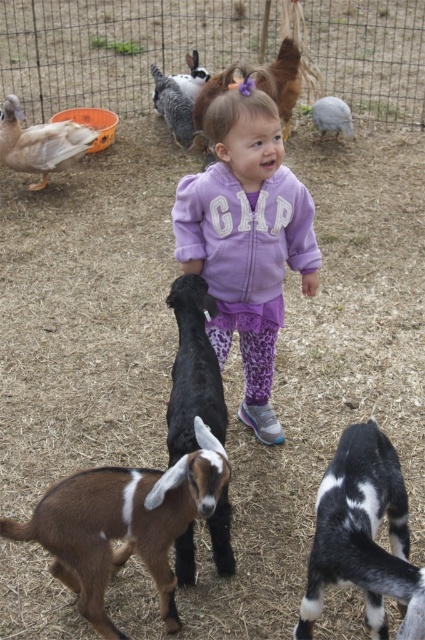
Consider the image. You are standing at point [22,129] and want to walk to the young girl in the purple hoodie. Which direction should you move to reach her without going behind point [346,458]?

To reach the young girl in the purple hoodie without going behind point [346,458], you should move forward towards point [346,458] since it is in front of your current position at point [22,129].

You are a zookeeper who needs to feed the black and white fur goat at center. You have a 1.5 meter long feeding stick. Can you reach the goat without moving closer?

The distance between the black and white fur goat at center and the camera is 1.47 meters. Since the feeding stick is 1.5 meters long, you can reach the goat without moving closer.